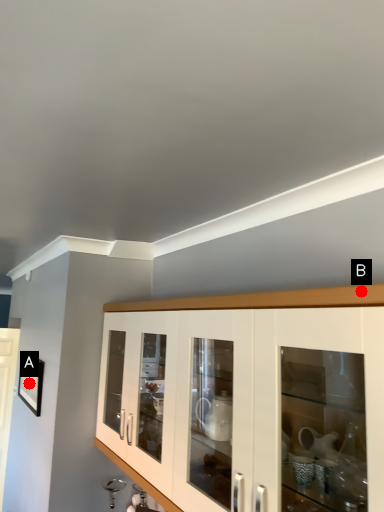
Question: Two points are circled on the image, labeled by A and B beside each circle. Which point appears farthest from the camera in this image?

Choices:
 (A) A is further
 (B) B is further

Answer: (A)